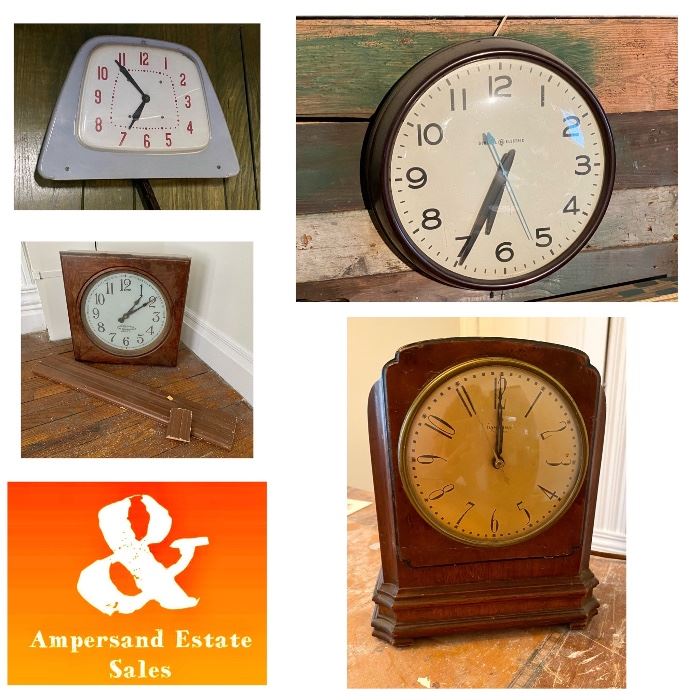
Where is `clock housing`? The width and height of the screenshot is (700, 700). clock housing is located at coordinates (172, 278), (427, 372), (400, 94), (220, 145).